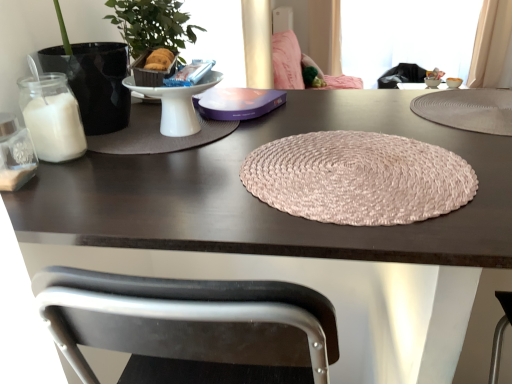
Question: Considering the relative sizes of pink woven placemat at center and transparent plastic window screen at upper right in the image provided, is pink woven placemat at center wider than transparent plastic window screen at upper right?

Choices:
 (A) no
 (B) yes

Answer: (B)

Question: Does pink woven placemat at center contain transparent plastic window screen at upper right?

Choices:
 (A) yes
 (B) no

Answer: (B)

Question: From a real-world perspective, does pink woven placemat at center stand above transparent plastic window screen at upper right?

Choices:
 (A) yes
 (B) no

Answer: (A)

Question: Considering the relative positions of pink woven placemat at center and transparent plastic window screen at upper right in the image provided, is pink woven placemat at center to the right of transparent plastic window screen at upper right from the viewer's perspective?

Choices:
 (A) no
 (B) yes

Answer: (A)

Question: Is pink woven placemat at center not within transparent plastic window screen at upper right?

Choices:
 (A) yes
 (B) no

Answer: (A)

Question: Considering the positions of beige woven mat at upper right, the 2th mat from the left, and matte black placemat at left, which is the second mat in right-to-left order, in the image, is beige woven mat at upper right, the 2th mat from the left, bigger or smaller than matte black placemat at left, which is the second mat in right-to-left order,?

Choices:
 (A) big
 (B) small

Answer: (A)

Question: Is beige woven mat at upper right, the 1th mat from the right, spatially inside matte black placemat at left, which is the second mat in right-to-left order, or outside of it?

Choices:
 (A) inside
 (B) outside

Answer: (B)

Question: From a real-world perspective, is beige woven mat at upper right, the 2th mat from the left, positioned above or below matte black placemat at left, the 1th mat positioned from the left?

Choices:
 (A) below
 (B) above

Answer: (A)

Question: From the image's perspective, is beige woven mat at upper right, the 2th mat from the left, above or below matte black placemat at left, the 1th mat positioned from the left?

Choices:
 (A) below
 (B) above

Answer: (B)

Question: In terms of height, does beige woven mat at upper right, the 2th mat from the left, look taller or shorter compared to clear glass candle holder at left?

Choices:
 (A) short
 (B) tall

Answer: (A)

Question: Looking at the image, does beige woven mat at upper right, the 2th mat from the left, seem bigger or smaller compared to clear glass candle holder at left?

Choices:
 (A) small
 (B) big

Answer: (B)

Question: Is point (448, 114) closer or farther from the camera than point (25, 180)?

Choices:
 (A) closer
 (B) farther

Answer: (B)

Question: From a real-world perspective, is beige woven mat at upper right, the 1th mat from the right, physically located above or below clear glass candle holder at left?

Choices:
 (A) above
 (B) below

Answer: (B)

Question: Considering the positions of green leafy plant at left and transparent plastic window screen at upper right in the image, is green leafy plant at left bigger or smaller than transparent plastic window screen at upper right?

Choices:
 (A) small
 (B) big

Answer: (A)

Question: Would you say green leafy plant at left is to the left or to the right of transparent plastic window screen at upper right in the picture?

Choices:
 (A) right
 (B) left

Answer: (B)